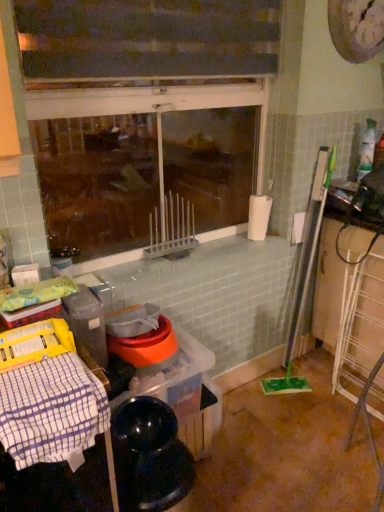
Question: Is white checkered cloth at lower left located within transparent glass window at center?

Choices:
 (A) no
 (B) yes

Answer: (A)

Question: Is the surface of transparent glass window at center in direct contact with white checkered cloth at lower left?

Choices:
 (A) yes
 (B) no

Answer: (B)

Question: Can you confirm if transparent glass window at center is taller than white checkered cloth at lower left?

Choices:
 (A) yes
 (B) no

Answer: (A)

Question: Does transparent glass window at center have a lesser height compared to white checkered cloth at lower left?

Choices:
 (A) yes
 (B) no

Answer: (B)

Question: Could you tell me if transparent glass window at center is facing white checkered cloth at lower left?

Choices:
 (A) no
 (B) yes

Answer: (B)

Question: Does transparent glass window at center have a lesser width compared to white checkered cloth at lower left?

Choices:
 (A) no
 (B) yes

Answer: (B)

Question: Considering the relative sizes of white checkered cloth at lower left and transparent glass window at center in the image provided, is white checkered cloth at lower left wider than transparent glass window at center?

Choices:
 (A) no
 (B) yes

Answer: (B)

Question: Is white checkered cloth at lower left taller than transparent glass window at center?

Choices:
 (A) yes
 (B) no

Answer: (B)

Question: Can you confirm if white checkered cloth at lower left is smaller than transparent glass window at center?

Choices:
 (A) yes
 (B) no

Answer: (A)

Question: Is white checkered cloth at lower left turned away from transparent glass window at center?

Choices:
 (A) yes
 (B) no

Answer: (B)

Question: From a real-world perspective, does white checkered cloth at lower left sit lower than transparent glass window at center?

Choices:
 (A) yes
 (B) no

Answer: (A)

Question: Does white checkered cloth at lower left have a larger size compared to transparent glass window at center?

Choices:
 (A) no
 (B) yes

Answer: (A)

Question: Relative to white checkered cloth at lower left, is transparent glass window at center in front or behind?

Choices:
 (A) behind
 (B) front

Answer: (A)